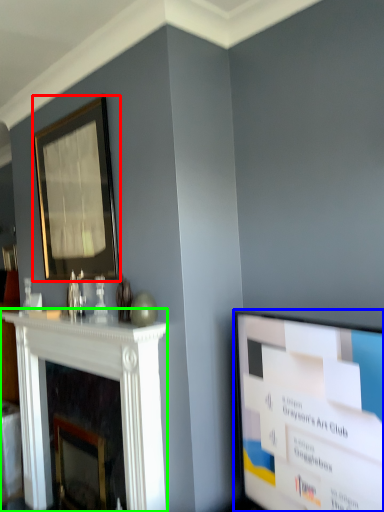
Question: Which is farther away from picture frame (highlighted by a red box)? television (highlighted by a blue box) or fireplace (highlighted by a green box)?

Choices:
 (A) television
 (B) fireplace

Answer: (A)